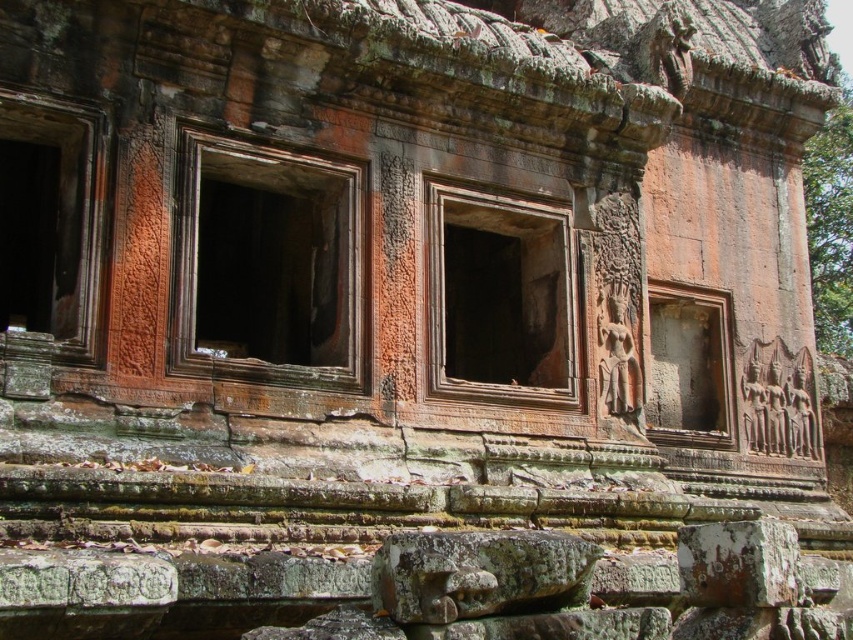
You are an archaeologist examining the ancient stone structure. You notice the brown stone window at left and the carved stone relief at center. Which of these two features has a larger size?

The brown stone window at left is bigger than the carved stone relief at center, so the brown stone window at left has a larger size.